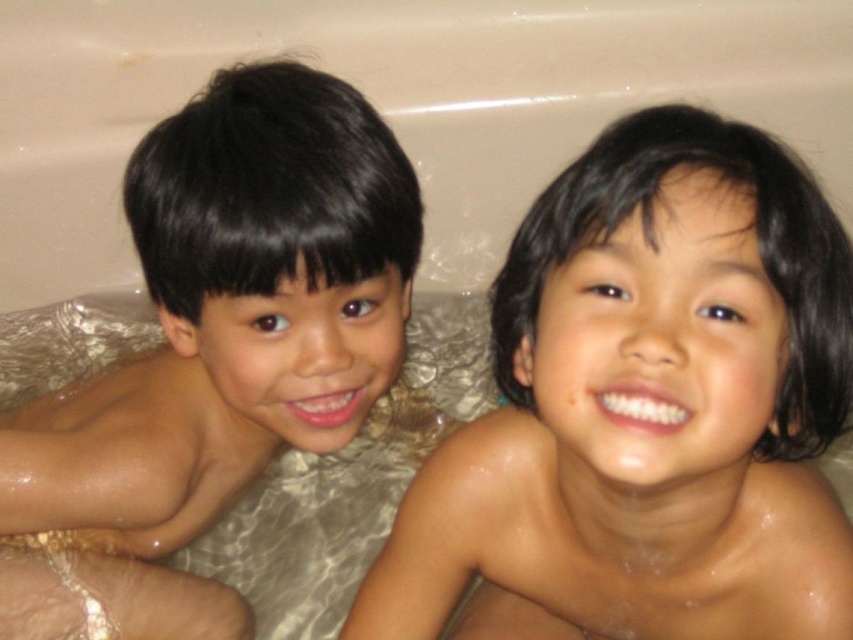
Where is `dry skin child at center`? Image resolution: width=853 pixels, height=640 pixels. dry skin child at center is located at coordinates (647, 410).

Consider the image. Is dry skin child at center closer to the viewer compared to brown matte skin at left?

Yes.

Where is `dry skin child at center`? The width and height of the screenshot is (853, 640). dry skin child at center is located at coordinates [x=647, y=410].